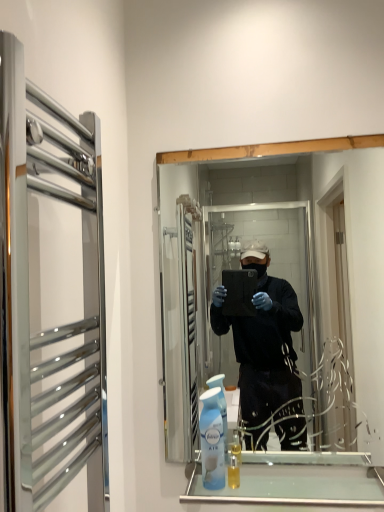
Measure the distance between clear glass towel rack at left and camera.

The depth of clear glass towel rack at left is 19.69 inches.

Describe the element at coordinates (268, 289) in the screenshot. Image resolution: width=384 pixels, height=512 pixels. I see `clear glass mirror at center` at that location.

Identify the location of translucent plastic mouthwash at lower center. coord(233,473).

From a real-world perspective, does translucent plastic mouthwash at lower center sit lower than clear glass mirror at center?

Indeed, from a real-world perspective, translucent plastic mouthwash at lower center is positioned beneath clear glass mirror at center.

Can you confirm if translucent plastic mouthwash at lower center is shorter than clear glass mirror at center?

Correct, translucent plastic mouthwash at lower center is not as tall as clear glass mirror at center.

Based on the photo, from the image's perspective, would you say translucent plastic mouthwash at lower center is shown under clear glass mirror at center?

Yes, from the image's perspective, translucent plastic mouthwash at lower center is beneath clear glass mirror at center.

Locate an element on the screen. Image resolution: width=384 pixels, height=512 pixels. mirror above the translucent plastic mouthwash at lower center (from a real-world perspective) is located at coordinates (268, 289).

Is light blue plastic air freshener at lower center at the right side of clear glass mirror at center?

In fact, light blue plastic air freshener at lower center is to the left of clear glass mirror at center.

From the image's perspective, is light blue plastic air freshener at lower center located beneath clear glass mirror at center?

Yes, from the image's perspective, light blue plastic air freshener at lower center is beneath clear glass mirror at center.

Which of these two, light blue plastic air freshener at lower center or clear glass mirror at center, is bigger?

Bigger between the two is clear glass mirror at center.

Does light blue plastic air freshener at lower center lie behind clear glass mirror at center?

No, it is in front of clear glass mirror at center.

Consider the image. From a real-world perspective, is clear glass towel rack at left located higher than clear glass mirror at center?

No, from a real-world perspective, clear glass towel rack at left is not above clear glass mirror at center.

Is clear glass towel rack at left thinner than clear glass mirror at center?

No, clear glass towel rack at left is not thinner than clear glass mirror at center.

Which object is further away from the camera, clear glass towel rack at left or clear glass mirror at center?

clear glass mirror at center is more distant.

Does clear glass towel rack at left have a lesser height compared to clear glass mirror at center?

Yes, clear glass towel rack at left is shorter than clear glass mirror at center.

Considering the sizes of objects translucent plastic mouthwash at lower center and clear glass cabinet at lower center in the image provided, who is wider, translucent plastic mouthwash at lower center or clear glass cabinet at lower center?

clear glass cabinet at lower center.

Consider the image. Relative to clear glass cabinet at lower center, is translucent plastic mouthwash at lower center in front or behind?

Visually, translucent plastic mouthwash at lower center is located behind clear glass cabinet at lower center.

From a real-world perspective, is translucent plastic mouthwash at lower center above or below clear glass cabinet at lower center?

translucent plastic mouthwash at lower center is above clear glass cabinet at lower center.

Which object is positioned more to the left, translucent plastic mouthwash at lower center or clear glass cabinet at lower center?

From the viewer's perspective, translucent plastic mouthwash at lower center appears more on the left side.

Is point (365, 494) closer to viewer compared to point (14, 51)?

No, (365, 494) is further to viewer.

Where is `glass door on the left side of clear glass cabinet at lower center`? glass door on the left side of clear glass cabinet at lower center is located at coordinates (49, 295).

Considering the relative sizes of clear glass cabinet at lower center and clear glass towel rack at left in the image provided, is clear glass cabinet at lower center smaller than clear glass towel rack at left?

Indeed, clear glass cabinet at lower center has a smaller size compared to clear glass towel rack at left.

From a real-world perspective, is clear glass cabinet at lower center positioned over clear glass towel rack at left based on gravity?

No, from a real-world perspective, clear glass cabinet at lower center is not above clear glass towel rack at left.

In terms of height, does clear glass towel rack at left look taller or shorter compared to light blue plastic air freshener at lower center?

Considering their sizes, clear glass towel rack at left has more height than light blue plastic air freshener at lower center.

Would you say clear glass towel rack at left is a long distance from light blue plastic air freshener at lower center?

No, there isn't a large distance between clear glass towel rack at left and light blue plastic air freshener at lower center.

From the image's perspective, is clear glass towel rack at left on light blue plastic air freshener at lower center?

Yes, from the image's perspective, clear glass towel rack at left is over light blue plastic air freshener at lower center.

Which point is more forward, (52, 303) or (275, 493)?

The point (52, 303) is closer to the camera.

Is clear glass towel rack at left facing away from clear glass cabinet at lower center?

No, clear glass cabinet at lower center is not at the back of clear glass towel rack at left.

From a real-world perspective, is clear glass towel rack at left above or below clear glass cabinet at lower center?

From a real-world perspective, clear glass towel rack at left is physically above clear glass cabinet at lower center.

Are clear glass towel rack at left and clear glass cabinet at lower center making contact?

No, clear glass towel rack at left is not beside clear glass cabinet at lower center.

You are a GUI agent. You are given a task and a screenshot of the screen. Output one action in this format:
    pyautogui.click(x=<x>, y=<y>)
    Task: Click on the mirror lying above the translucent plastic mouthwash at lower center (from the image's perspective)
    The height and width of the screenshot is (512, 384).
    Given the screenshot: What is the action you would take?
    pyautogui.click(x=268, y=289)

At what (x,y) coordinates should I click in order to perform the action: click on mirror lying behind the light blue plastic air freshener at lower center. Please return your answer as a coordinate pair (x, y). The image size is (384, 512). Looking at the image, I should click on (268, 289).

Looking at the image, which one is located further to clear glass cabinet at lower center, clear glass towel rack at left or clear glass mirror at center?

clear glass towel rack at left is positioned further to the anchor clear glass cabinet at lower center.

From the image, which object appears to be nearer to light blue plastic air freshener at lower center, clear glass cabinet at lower center or clear glass mirror at center?

The object closer to light blue plastic air freshener at lower center is clear glass cabinet at lower center.

Looking at the image, which one is located further to light blue plastic air freshener at lower center, clear glass mirror at center or clear glass cabinet at lower center?

clear glass mirror at center is further to light blue plastic air freshener at lower center.

Looking at the image, which one is located closer to clear glass mirror at center, light blue plastic air freshener at lower center or translucent plastic mouthwash at lower center?

light blue plastic air freshener at lower center lies closer to clear glass mirror at center than the other object.

Looking at the image, which one is located closer to light blue plastic air freshener at lower center, clear glass towel rack at left or translucent plastic mouthwash at lower center?

The object closer to light blue plastic air freshener at lower center is translucent plastic mouthwash at lower center.

Estimate the real-world distances between objects in this image. Which object is closer to clear glass cabinet at lower center, clear glass mirror at center or light blue plastic air freshener at lower center?

light blue plastic air freshener at lower center.

Looking at the image, which one is located further to clear glass cabinet at lower center, translucent plastic mouthwash at lower center or clear glass towel rack at left?

clear glass towel rack at left lies further to clear glass cabinet at lower center than the other object.

Considering their positions, is clear glass towel rack at left positioned further to clear glass mirror at center than light blue plastic air freshener at lower center?

The object further to clear glass mirror at center is clear glass towel rack at left.

This screenshot has width=384, height=512. I want to click on cleaning product between clear glass towel rack at left and translucent plastic mouthwash at lower center along the z-axis, so point(212,441).

This screenshot has height=512, width=384. Identify the location of cleaning product between clear glass mirror at center and translucent plastic mouthwash at lower center from top to bottom. (212, 441).

Identify the location of cabinet between clear glass towel rack at left and light blue plastic air freshener at lower center in the front-back direction. This screenshot has width=384, height=512. (297, 480).

Find the location of a particular element. The width and height of the screenshot is (384, 512). mouthwash located between light blue plastic air freshener at lower center and clear glass cabinet at lower center in the left-right direction is located at coordinates (233, 473).